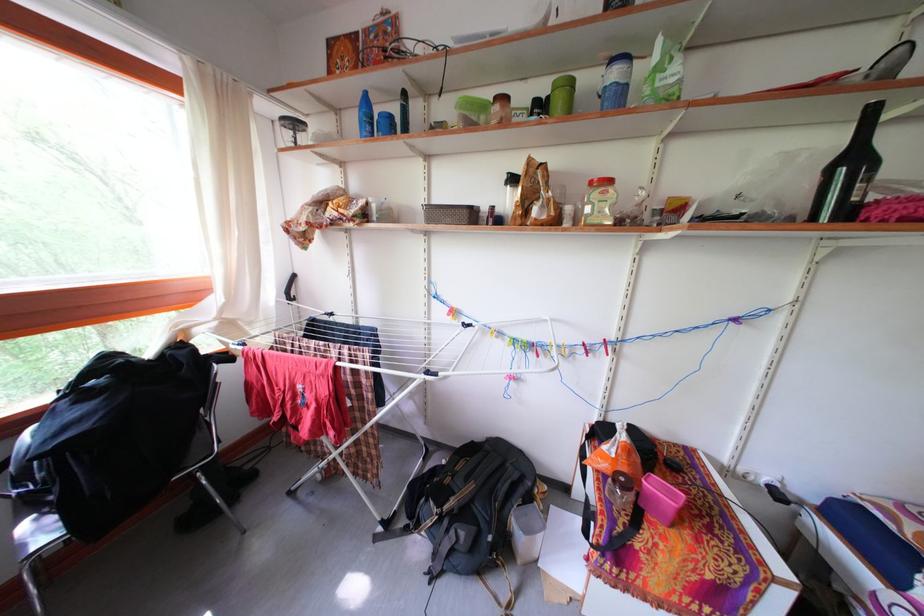
Which object does [615,82] point to?

This point indicates the clear plastic bottle.